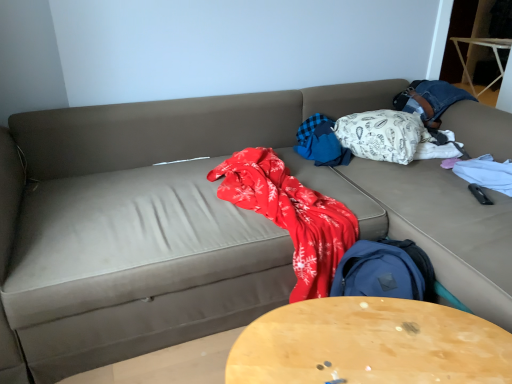
Image resolution: width=512 pixels, height=384 pixels. Identify the location of blue plaid blanket at center, arranged as the first blanket when viewed from the left. (321, 142).

How much space does white patterned fabric at upper right, acting as the second blanket starting from the left, occupy horizontally?

18.08 inches.

Describe the element at coordinates (370, 344) in the screenshot. I see `wooden round table at center` at that location.

Identify the location of blue plaid blanket at center, which appears as the second blanket when viewed from the right. Image resolution: width=512 pixels, height=384 pixels. (321, 142).

From the picture: Considering the sizes of white patterned fabric at upper right, the first blanket when ordered from right to left, and blue plaid blanket at center, arranged as the first blanket when viewed from the left, in the image, is white patterned fabric at upper right, the first blanket when ordered from right to left, taller or shorter than blue plaid blanket at center, arranged as the first blanket when viewed from the left,?

Considering their sizes, white patterned fabric at upper right, the first blanket when ordered from right to left, has more height than blue plaid blanket at center, arranged as the first blanket when viewed from the left.

Considering the positions of points (383, 131) and (334, 123), is point (383, 131) closer to camera compared to point (334, 123)?

That is True.

From the image's perspective, which is above, white patterned fabric at upper right, acting as the second blanket starting from the left, or blue plaid blanket at center, which appears as the second blanket when viewed from the right?

white patterned fabric at upper right, acting as the second blanket starting from the left.

Can you confirm if blue plaid blanket at center, which appears as the second blanket when viewed from the right, is thinner than wooden round table at center?

Correct, the width of blue plaid blanket at center, which appears as the second blanket when viewed from the right, is less than that of wooden round table at center.

Which is more to the right, blue plaid blanket at center, arranged as the first blanket when viewed from the left, or wooden round table at center?

blue plaid blanket at center, arranged as the first blanket when viewed from the left, is more to the right.

From the picture: Between blue plaid blanket at center, arranged as the first blanket when viewed from the left, and wooden round table at center, which one has larger size?

Bigger between the two is wooden round table at center.

Would you say blue plaid blanket at center, arranged as the first blanket when viewed from the left, is inside or outside wooden round table at center?

The correct answer is: outside.

Is wooden round table at center outside of blue plaid blanket at center, which appears as the second blanket when viewed from the right?

Yes, wooden round table at center is located beyond the bounds of blue plaid blanket at center, which appears as the second blanket when viewed from the right.

From a real-world perspective, who is located higher, wooden round table at center or blue plaid blanket at center, arranged as the first blanket when viewed from the left?

From a 3D spatial view, blue plaid blanket at center, arranged as the first blanket when viewed from the left, is above.

Locate an element on the screen. Image resolution: width=512 pixels, height=384 pixels. table lying on the left of blue plaid blanket at center, arranged as the first blanket when viewed from the left is located at coordinates (370, 344).

Can you confirm if blue plaid blanket at center, arranged as the first blanket when viewed from the left, is positioned to the right of white patterned fabric at upper right, acting as the second blanket starting from the left?

Incorrect, blue plaid blanket at center, arranged as the first blanket when viewed from the left, is not on the right side of white patterned fabric at upper right, acting as the second blanket starting from the left.

From the image's perspective, is blue plaid blanket at center, which appears as the second blanket when viewed from the right, above white patterned fabric at upper right, acting as the second blanket starting from the left?

No, from the image's perspective, blue plaid blanket at center, which appears as the second blanket when viewed from the right, is not above white patterned fabric at upper right, acting as the second blanket starting from the left.

Is blue plaid blanket at center, arranged as the first blanket when viewed from the left, located outside white patterned fabric at upper right, acting as the second blanket starting from the left?

blue plaid blanket at center, arranged as the first blanket when viewed from the left, is positioned outside white patterned fabric at upper right, acting as the second blanket starting from the left.

Considering the sizes of objects blue plaid blanket at center, which appears as the second blanket when viewed from the right, and white patterned fabric at upper right, the first blanket when ordered from right to left, in the image provided, who is shorter, blue plaid blanket at center, which appears as the second blanket when viewed from the right, or white patterned fabric at upper right, the first blanket when ordered from right to left,?

blue plaid blanket at center, which appears as the second blanket when viewed from the right, is shorter.

From their relative heights in the image, would you say wooden round table at center is taller or shorter than white patterned fabric at upper right, acting as the second blanket starting from the left?

Clearly, wooden round table at center is taller compared to white patterned fabric at upper right, acting as the second blanket starting from the left.

From a real-world perspective, is wooden round table at center located beneath white patterned fabric at upper right, acting as the second blanket starting from the left?

Yes, from a real-world perspective, wooden round table at center is under white patterned fabric at upper right, acting as the second blanket starting from the left.

Would you say white patterned fabric at upper right, acting as the second blanket starting from the left, is part of wooden round table at center's contents?

Actually, white patterned fabric at upper right, acting as the second blanket starting from the left, is outside wooden round table at center.

Based on the photo, how distant is wooden round table at center from white patterned fabric at upper right, the first blanket when ordered from right to left?

wooden round table at center is 1.11 meters from white patterned fabric at upper right, the first blanket when ordered from right to left.

In the image, is white patterned fabric at upper right, the first blanket when ordered from right to left, on the left side or the right side of wooden round table at center?

From the image, it's evident that white patterned fabric at upper right, the first blanket when ordered from right to left, is to the right of wooden round table at center.

Does white patterned fabric at upper right, the first blanket when ordered from right to left, come in front of wooden round table at center?

That is False.

Locate an element on the screen. This screenshot has height=384, width=512. blanket that is on the right side of blue plaid blanket at center, arranged as the first blanket when viewed from the left is located at coordinates (382, 135).

Find the location of a particular element. The height and width of the screenshot is (384, 512). table in front of the blue plaid blanket at center, which appears as the second blanket when viewed from the right is located at coordinates (370, 344).

From the image, which object appears to be nearer to white patterned fabric at upper right, the first blanket when ordered from right to left, blue plaid blanket at center, arranged as the first blanket when viewed from the left, or wooden round table at center?

blue plaid blanket at center, arranged as the first blanket when viewed from the left, lies closer to white patterned fabric at upper right, the first blanket when ordered from right to left, than the other object.

Estimate the real-world distances between objects in this image. Which object is further from white patterned fabric at upper right, the first blanket when ordered from right to left, wooden round table at center or blue plaid blanket at center, which appears as the second blanket when viewed from the right?

wooden round table at center.

Based on their spatial positions, is blue plaid blanket at center, arranged as the first blanket when viewed from the left, or white patterned fabric at upper right, acting as the second blanket starting from the left, closer to wooden round table at center?

Based on the image, blue plaid blanket at center, arranged as the first blanket when viewed from the left, appears to be nearer to wooden round table at center.

Looking at the image, which one is located further to blue plaid blanket at center, arranged as the first blanket when viewed from the left, wooden round table at center or white patterned fabric at upper right, the first blanket when ordered from right to left?

wooden round table at center is further to blue plaid blanket at center, arranged as the first blanket when viewed from the left.

Estimate the real-world distances between objects in this image. Which object is further from blue plaid blanket at center, which appears as the second blanket when viewed from the right, white patterned fabric at upper right, acting as the second blanket starting from the left, or wooden round table at center?

wooden round table at center lies further to blue plaid blanket at center, which appears as the second blanket when viewed from the right, than the other object.

Which object lies nearer to the anchor point wooden round table at center, white patterned fabric at upper right, the first blanket when ordered from right to left, or blue plaid blanket at center, which appears as the second blanket when viewed from the right?

Among the two, blue plaid blanket at center, which appears as the second blanket when viewed from the right, is located nearer to wooden round table at center.

This screenshot has height=384, width=512. What are the coordinates of `blanket positioned between wooden round table at center and blue plaid blanket at center, arranged as the first blanket when viewed from the left, from near to far` in the screenshot? It's located at point(382,135).